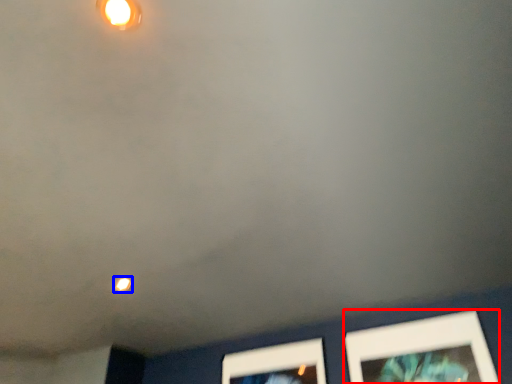
Question: Which of the following is the farthest to the observer, picture frame (highlighted by a red box) or light (highlighted by a blue box)?

Choices:
 (A) picture frame
 (B) light

Answer: (B)